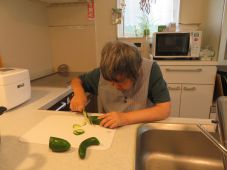
Pinpoint the coordinates of where you'd open the drawer in the image. Your answer should be formatted as a list of tuples, i.e. [(x1, y1), (x2, y2), ...], where each tuple contains the x and y coordinates of a point satisfying the conditions above.

[(188, 70)]